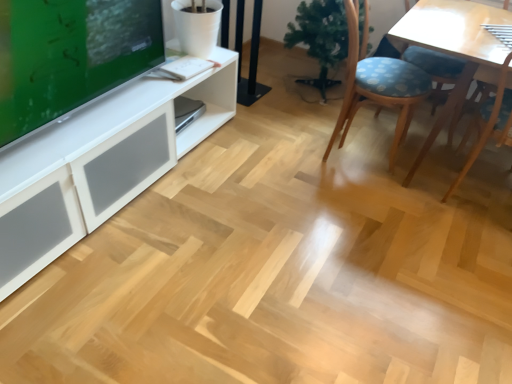
Question: From a real-world perspective, is green matte artificial plant at center beneath blue fabric chair at center-right?

Choices:
 (A) no
 (B) yes

Answer: (B)

Question: Considering the relative sizes of green matte artificial plant at center and blue fabric chair at center-right in the image provided, is green matte artificial plant at center smaller than blue fabric chair at center-right?

Choices:
 (A) yes
 (B) no

Answer: (A)

Question: Can blue fabric chair at center-right be found inside green matte artificial plant at center?

Choices:
 (A) no
 (B) yes

Answer: (A)

Question: Considering the relative sizes of green matte artificial plant at center and blue fabric chair at center-right in the image provided, is green matte artificial plant at center bigger than blue fabric chair at center-right?

Choices:
 (A) yes
 (B) no

Answer: (B)

Question: Considering the relative positions of green matte artificial plant at center and blue fabric chair at center-right in the image provided, is green matte artificial plant at center in front of blue fabric chair at center-right?

Choices:
 (A) no
 (B) yes

Answer: (A)

Question: Are green matte artificial plant at center and blue fabric chair at center-right located far from each other?

Choices:
 (A) yes
 (B) no

Answer: (B)

Question: Are blue fabric chair at center-right and green matte artificial plant at center making contact?

Choices:
 (A) no
 (B) yes

Answer: (A)

Question: From the image's perspective, is blue fabric chair at center-right over green matte artificial plant at center?

Choices:
 (A) yes
 (B) no

Answer: (B)

Question: Is blue fabric chair at center-right surrounding green matte artificial plant at center?

Choices:
 (A) yes
 (B) no

Answer: (B)

Question: Does blue fabric chair at center-right appear on the left side of green matte artificial plant at center?

Choices:
 (A) yes
 (B) no

Answer: (B)

Question: Is blue fabric chair at center-right in front of green matte artificial plant at center?

Choices:
 (A) no
 (B) yes

Answer: (B)

Question: Is blue fabric chair at center-right looking in the opposite direction of green matte artificial plant at center?

Choices:
 (A) no
 (B) yes

Answer: (A)

Question: Is blue fabric chair at center-right smaller than green glossy tv at upper left?

Choices:
 (A) no
 (B) yes

Answer: (A)